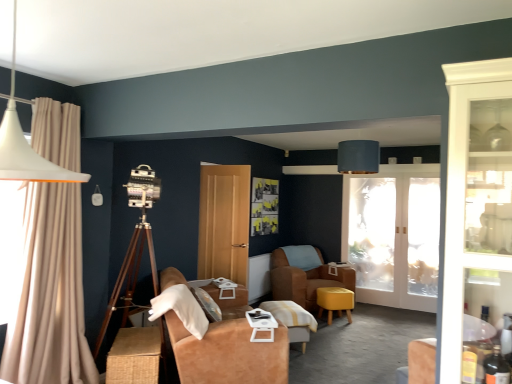
Question: Considering the relative sizes of frosted glass window screen at center and matte yellow stool at center in the image provided, is frosted glass window screen at center taller than matte yellow stool at center?

Choices:
 (A) yes
 (B) no

Answer: (A)

Question: Is frosted glass window screen at center thinner than matte yellow stool at center?

Choices:
 (A) yes
 (B) no

Answer: (A)

Question: Is frosted glass window screen at center with matte yellow stool at center?

Choices:
 (A) yes
 (B) no

Answer: (B)

Question: Does frosted glass window screen at center contain matte yellow stool at center?

Choices:
 (A) yes
 (B) no

Answer: (B)

Question: Is frosted glass window screen at center not near matte yellow stool at center?

Choices:
 (A) no
 (B) yes

Answer: (A)

Question: From a real-world perspective, does frosted glass window screen at center sit lower than matte yellow stool at center?

Choices:
 (A) no
 (B) yes

Answer: (A)

Question: Considering the relative sizes of wooden table at center, the third table viewed from the left, and white plastic tray at center, the 2th table when ordered from right to left, in the image provided, is wooden table at center, the third table viewed from the left, wider than white plastic tray at center, the 2th table when ordered from right to left,?

Choices:
 (A) no
 (B) yes

Answer: (B)

Question: From a real-world perspective, is wooden table at center, which appears as the 1th table when viewed from the back, on top of white plastic tray at center, marked as the 2th table in a left-to-right arrangement?

Choices:
 (A) yes
 (B) no

Answer: (B)

Question: Is wooden table at center, the third table viewed from the left, further to the viewer compared to white plastic tray at center, the 1th table in the front-to-back sequence?

Choices:
 (A) yes
 (B) no

Answer: (A)

Question: Is the position of wooden table at center, placed as the 1th table when sorted from right to left, less distant than that of white plastic tray at center, the 1th table in the front-to-back sequence?

Choices:
 (A) no
 (B) yes

Answer: (A)

Question: Is white plastic tray at center, which appears as the 3th table when viewed from the back, completely or partially inside wooden table at center, acting as the 3th table starting from the front?

Choices:
 (A) no
 (B) yes

Answer: (A)

Question: Is wooden table at center, which appears as the 1th table when viewed from the back, bigger than white plastic tray at center, the 1th table in the front-to-back sequence?

Choices:
 (A) yes
 (B) no

Answer: (A)

Question: From the image's perspective, would you say white plastic tray at center, the 2th table when ordered from right to left, is shown under wooden tripod at left?

Choices:
 (A) no
 (B) yes

Answer: (B)